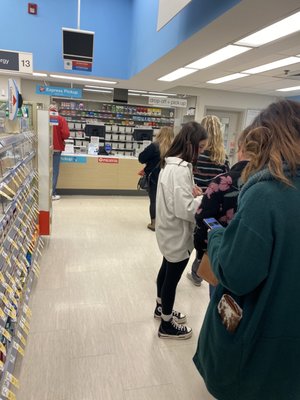
At what (x,y) coordinates should I click in order to perform the action: click on floor right of shelf. Please return your answer as a coordinate pair (x, y). Image resolution: width=300 pixels, height=400 pixels. Looking at the image, I should click on (84, 320).